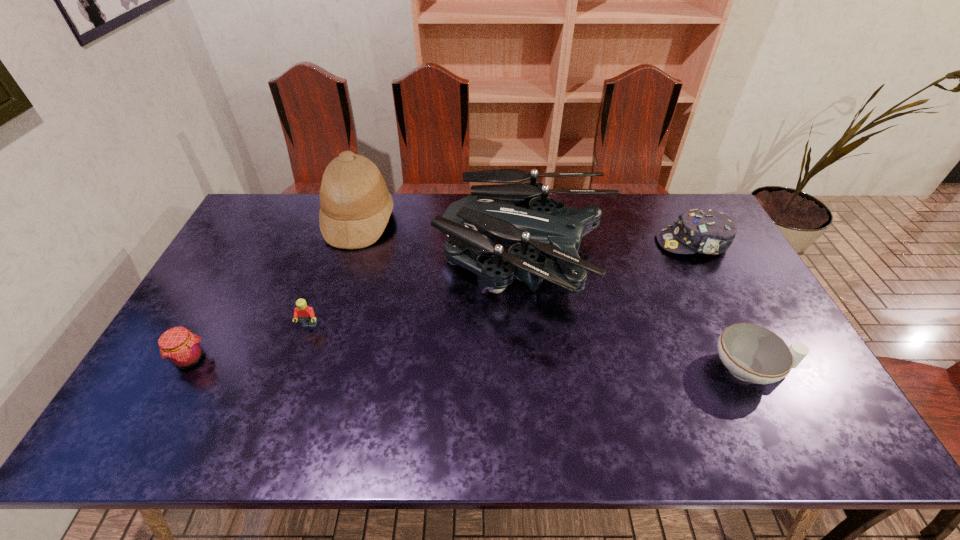
The width and height of the screenshot is (960, 540). In order to click on object that is positioned at the far right corner in this screenshot , I will do `click(705, 231)`.

This screenshot has height=540, width=960. I want to click on vacant space at the far edge of the desktop, so click(653, 218).

At what (x,y) coordinates should I click in order to perform the action: click on free point at the near edge. Please return your answer as a coordinate pair (x, y). The width and height of the screenshot is (960, 540). Looking at the image, I should click on (606, 417).

You are a GUI agent. You are given a task and a screenshot of the screen. Output one action in this format:
    pyautogui.click(x=<x>, y=<y>)
    Task: Click on the vacant position at the left edge of the desktop
    This screenshot has height=540, width=960.
    Given the screenshot: What is the action you would take?
    pyautogui.click(x=156, y=411)

Where is `vacant space at the right edge`? The width and height of the screenshot is (960, 540). vacant space at the right edge is located at coordinates (823, 408).

Locate an element on the screen. This screenshot has height=540, width=960. vacant space at the far left corner of the desktop is located at coordinates (253, 225).

At what (x,y) coordinates should I click in order to perform the action: click on empty space that is in between the Lego and the drone. Please return your answer as a coordinate pair (x, y). The image size is (960, 540). Looking at the image, I should click on (418, 295).

Locate an element on the screen. free space between the Lego and the hat is located at coordinates (334, 273).

You are a GUI agent. You are given a task and a screenshot of the screen. Output one action in this format:
    pyautogui.click(x=<x>, y=<y>)
    Task: Click on the free space between the chinaware and the third object from right to left
    The height and width of the screenshot is (540, 960).
    Given the screenshot: What is the action you would take?
    pyautogui.click(x=638, y=317)

The width and height of the screenshot is (960, 540). I want to click on vacant space that's between the headwear and the drone, so [x=610, y=254].